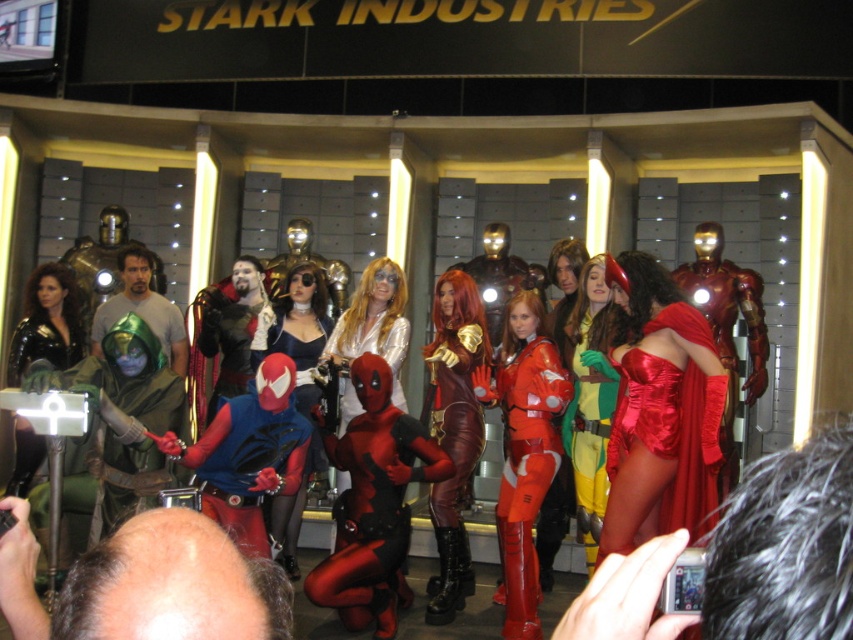
Question: Estimate the real-world distances between objects in this image. Which object is closer to the shiny blue dress at center?

Choices:
 (A) black leather jacket at left
 (B) shiny red bodysuit at center
 (C) leather-like red suit at center

Answer: (C)

Question: Is shiny red suit at center bigger than black leather jacket at left?

Choices:
 (A) no
 (B) yes

Answer: (B)

Question: Considering the real-world distances, which object is farthest from the shiny blue dress at center?

Choices:
 (A) satin red dress at center
 (B) shiny red suit at center

Answer: (A)

Question: Can you confirm if shiny blue dress at center is positioned below shiny silver dress at center?

Choices:
 (A) no
 (B) yes

Answer: (A)

Question: Can you confirm if shiny red suit at center is positioned to the right of shiny red bodysuit at center?

Choices:
 (A) no
 (B) yes

Answer: (A)

Question: Which point is closer to the camera taking this photo?

Choices:
 (A) (62, 353)
 (B) (300, 406)

Answer: (B)